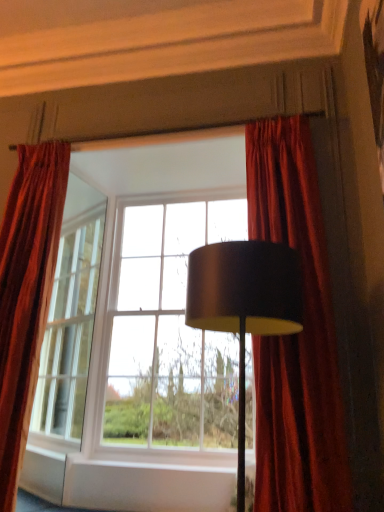
Locate an element on the screen. This screenshot has width=384, height=512. velvet red curtain at left, placed as the first curtain when sorted from left to right is located at coordinates (26, 294).

The height and width of the screenshot is (512, 384). I want to click on matte black lampshade at center, so click(244, 303).

Image resolution: width=384 pixels, height=512 pixels. What are the coordinates of `velvet red curtain at right, placed as the second curtain when sorted from left to right` in the screenshot? It's located at (295, 334).

Where is `velvet red curtain at left, placed as the first curtain when sorted from left to right`? velvet red curtain at left, placed as the first curtain when sorted from left to right is located at coordinates (26, 294).

Is the position of matte black lampshade at center more distant than that of matte glass window at center?

No.

Is matte black lampshade at center next to matte glass window at center?

No.

From a real-world perspective, is matte black lampshade at center physically above matte glass window at center?

No, from a real-world perspective, matte black lampshade at center is not above matte glass window at center.

From the image's perspective, does matte black lampshade at center appear lower than matte glass window at center?

Indeed, from the image's perspective, matte black lampshade at center is shown beneath matte glass window at center.

The image size is (384, 512). What are the coordinates of `curtain below the velvet red curtain at right, placed as the second curtain when sorted from left to right (from the image's perspective)` in the screenshot? It's located at (26, 294).

From the image's perspective, is velvet red curtain at right, arranged as the 1th curtain when viewed from the right, positioned above or below velvet red curtain at left, which appears as the 2th curtain when viewed from the right?

Based on their image positions, velvet red curtain at right, arranged as the 1th curtain when viewed from the right, is located above velvet red curtain at left, which appears as the 2th curtain when viewed from the right.

Is velvet red curtain at right, arranged as the 1th curtain when viewed from the right, wider or thinner than velvet red curtain at left, which appears as the 2th curtain when viewed from the right?

velvet red curtain at right, arranged as the 1th curtain when viewed from the right, is wider than velvet red curtain at left, which appears as the 2th curtain when viewed from the right.

Is matte black lampshade at center oriented towards velvet red curtain at left, which appears as the 2th curtain when viewed from the right?

Yes.

Is matte black lampshade at center wider or thinner than velvet red curtain at left, which appears as the 2th curtain when viewed from the right?

Clearly, matte black lampshade at center has more width compared to velvet red curtain at left, which appears as the 2th curtain when viewed from the right.

Is matte black lampshade at center positioned far away from velvet red curtain at left, which appears as the 2th curtain when viewed from the right?

Yes.

Which object is positioned more to the left, velvet red curtain at right, arranged as the 1th curtain when viewed from the right, or matte black lampshade at center?

From the viewer's perspective, matte black lampshade at center appears more on the left side.

From their relative heights in the image, would you say velvet red curtain at right, placed as the second curtain when sorted from left to right, is taller or shorter than matte black lampshade at center?

velvet red curtain at right, placed as the second curtain when sorted from left to right, is taller than matte black lampshade at center.

Looking at the image, does velvet red curtain at right, placed as the second curtain when sorted from left to right, seem bigger or smaller compared to matte black lampshade at center?

velvet red curtain at right, placed as the second curtain when sorted from left to right, is bigger than matte black lampshade at center.

How distant is velvet red curtain at right, placed as the second curtain when sorted from left to right, from matte black lampshade at center?

velvet red curtain at right, placed as the second curtain when sorted from left to right, and matte black lampshade at center are 23.97 inches apart from each other.

In terms of width, does velvet red curtain at left, placed as the first curtain when sorted from left to right, look wider or thinner when compared to velvet red curtain at right, placed as the second curtain when sorted from left to right?

velvet red curtain at left, placed as the first curtain when sorted from left to right, is thinner than velvet red curtain at right, placed as the second curtain when sorted from left to right.

Who is smaller, velvet red curtain at left, placed as the first curtain when sorted from left to right, or velvet red curtain at right, placed as the second curtain when sorted from left to right?

velvet red curtain at left, placed as the first curtain when sorted from left to right, is smaller.

Between velvet red curtain at left, placed as the first curtain when sorted from left to right, and velvet red curtain at right, arranged as the 1th curtain when viewed from the right, which one appears on the left side from the viewer's perspective?

Positioned to the left is velvet red curtain at left, placed as the first curtain when sorted from left to right.

Looking at their sizes, would you say velvet red curtain at left, which appears as the 2th curtain when viewed from the right, is wider or thinner than matte black lampshade at center?

In the image, velvet red curtain at left, which appears as the 2th curtain when viewed from the right, appears to be more narrow than matte black lampshade at center.

I want to click on lamp lying below the velvet red curtain at left, placed as the first curtain when sorted from left to right (from the image's perspective), so click(x=244, y=303).

Could you tell me if velvet red curtain at left, which appears as the 2th curtain when viewed from the right, is facing matte black lampshade at center?

No, velvet red curtain at left, which appears as the 2th curtain when viewed from the right, is not aimed at matte black lampshade at center.

From a real-world perspective, does velvet red curtain at left, which appears as the 2th curtain when viewed from the right, sit lower than matte black lampshade at center?

Actually, velvet red curtain at left, which appears as the 2th curtain when viewed from the right, is physically above matte black lampshade at center in the real world.

Is matte black lampshade at center thinner than velvet red curtain at right, arranged as the 1th curtain when viewed from the right?

Incorrect, the width of matte black lampshade at center is not less than that of velvet red curtain at right, arranged as the 1th curtain when viewed from the right.

Is point (235, 301) more distant than point (279, 430)?

That is False.

The image size is (384, 512). In order to click on curtain on the right of the matte black lampshade at center in this screenshot , I will do `click(295, 334)`.

How much distance is there between matte black lampshade at center and velvet red curtain at right, placed as the second curtain when sorted from left to right?

matte black lampshade at center and velvet red curtain at right, placed as the second curtain when sorted from left to right, are 60.89 centimeters apart from each other.

At what (x,y) coordinates should I click in order to perform the action: click on window that appears on the left of matte black lampshade at center. Please return your answer as a coordinate pair (x, y). The height and width of the screenshot is (512, 384). Looking at the image, I should click on (161, 296).

Where is `curtain below the velvet red curtain at right, placed as the second curtain when sorted from left to right (from a real-world perspective)`? This screenshot has height=512, width=384. curtain below the velvet red curtain at right, placed as the second curtain when sorted from left to right (from a real-world perspective) is located at coordinates (26, 294).

Looking at the image, which one is located closer to velvet red curtain at right, placed as the second curtain when sorted from left to right, matte glass window at center or matte black lampshade at center?

matte black lampshade at center.

Estimate the real-world distances between objects in this image. Which object is further from matte glass window at center, matte black lampshade at center or velvet red curtain at right, placed as the second curtain when sorted from left to right?

The object further to matte glass window at center is matte black lampshade at center.

When comparing their distances from velvet red curtain at right, arranged as the 1th curtain when viewed from the right, does velvet red curtain at left, placed as the first curtain when sorted from left to right, or matte black lampshade at center seem further?

velvet red curtain at left, placed as the first curtain when sorted from left to right.

Estimate the real-world distances between objects in this image. Which object is further from velvet red curtain at right, placed as the second curtain when sorted from left to right, matte black lampshade at center or velvet red curtain at left, placed as the first curtain when sorted from left to right?

velvet red curtain at left, placed as the first curtain when sorted from left to right.

Estimate the real-world distances between objects in this image. Which object is further from velvet red curtain at left, placed as the first curtain when sorted from left to right, matte black lampshade at center or matte glass window at center?

matte black lampshade at center lies further to velvet red curtain at left, placed as the first curtain when sorted from left to right, than the other object.

From the image, which object appears to be farther from matte glass window at center, velvet red curtain at left, which appears as the 2th curtain when viewed from the right, or matte black lampshade at center?

matte black lampshade at center.

Based on their spatial positions, is matte glass window at center or velvet red curtain at right, placed as the second curtain when sorted from left to right, further from matte black lampshade at center?

matte glass window at center is positioned further to the anchor matte black lampshade at center.

Considering their positions, is velvet red curtain at right, placed as the second curtain when sorted from left to right, positioned closer to matte black lampshade at center than matte glass window at center?

velvet red curtain at right, placed as the second curtain when sorted from left to right, is closer to matte black lampshade at center.

At what (x,y) coordinates should I click in order to perform the action: click on window located between velvet red curtain at left, placed as the first curtain when sorted from left to right, and velvet red curtain at right, placed as the second curtain when sorted from left to right, in the left-right direction. Please return your answer as a coordinate pair (x, y). The height and width of the screenshot is (512, 384). Looking at the image, I should click on (161, 296).

Where is `lamp located between velvet red curtain at left, placed as the first curtain when sorted from left to right, and velvet red curtain at right, placed as the second curtain when sorted from left to right, in the left-right direction`? The width and height of the screenshot is (384, 512). lamp located between velvet red curtain at left, placed as the first curtain when sorted from left to right, and velvet red curtain at right, placed as the second curtain when sorted from left to right, in the left-right direction is located at coordinates (244, 303).

Where is `window between velvet red curtain at left, which appears as the 2th curtain when viewed from the right, and matte black lampshade at center`? This screenshot has width=384, height=512. window between velvet red curtain at left, which appears as the 2th curtain when viewed from the right, and matte black lampshade at center is located at coordinates (161, 296).

Where is `lamp situated between matte glass window at center and velvet red curtain at right, placed as the second curtain when sorted from left to right, from left to right`? The height and width of the screenshot is (512, 384). lamp situated between matte glass window at center and velvet red curtain at right, placed as the second curtain when sorted from left to right, from left to right is located at coordinates (244, 303).